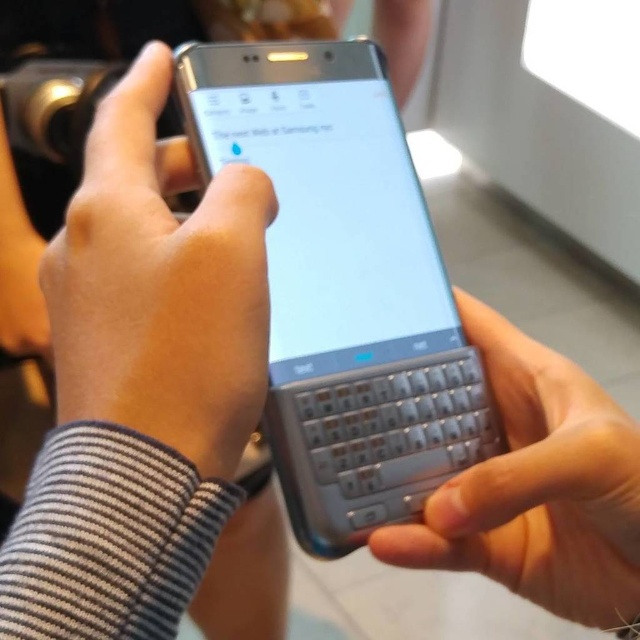
Is point (234, 268) positioned behind point (566, 524)?

No, it is in front of (566, 524).

Identify the location of matte black phone at center. The width and height of the screenshot is (640, 640). (160, 285).

Is slate metallic keyboard at center shorter than matte black phone at center?

No, slate metallic keyboard at center is not shorter than matte black phone at center.

Between slate metallic keyboard at center and matte black phone at center, which one has more height?

Standing taller between the two is slate metallic keyboard at center.

Does point (308, 93) lie in front of point (182, 189)?

No, it is not.

I want to click on slate metallic keyboard at center, so click(x=342, y=285).

Between slate metallic keyboard at center and silver metallic keyboard at center, which one is positioned higher?

slate metallic keyboard at center

Is slate metallic keyboard at center above silver metallic keyboard at center?

Indeed, slate metallic keyboard at center is positioned over silver metallic keyboard at center.

Who is more distant from viewer, (339, 456) or (515, 548)?

The point (515, 548) is behind.

What are the coordinates of `slate metallic keyboard at center` in the screenshot? It's located at (342, 285).